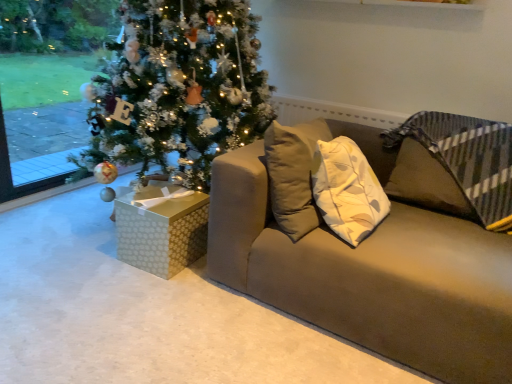
Question: From the image's perspective, is matte brown couch at center on top of gold-patterned gift box at lower left?

Choices:
 (A) yes
 (B) no

Answer: (A)

Question: Does matte brown couch at center come in front of gold-patterned gift box at lower left?

Choices:
 (A) yes
 (B) no

Answer: (A)

Question: From the image's perspective, would you say matte brown couch at center is shown under gold-patterned gift box at lower left?

Choices:
 (A) no
 (B) yes

Answer: (A)

Question: Is matte brown couch at center bigger than gold-patterned gift box at lower left?

Choices:
 (A) yes
 (B) no

Answer: (A)

Question: Is matte brown couch at center shorter than gold-patterned gift box at lower left?

Choices:
 (A) yes
 (B) no

Answer: (B)

Question: From a real-world perspective, is matte brown couch at center physically below gold-patterned gift box at lower left?

Choices:
 (A) no
 (B) yes

Answer: (A)

Question: Are gold-patterned gift box at lower left and matte brown couch at center making contact?

Choices:
 (A) yes
 (B) no

Answer: (B)

Question: Is matte brown couch at center completely or partially inside gold-patterned gift box at lower left?

Choices:
 (A) no
 (B) yes

Answer: (A)

Question: Considering the relative sizes of gold-patterned gift box at lower left and matte brown couch at center in the image provided, is gold-patterned gift box at lower left wider than matte brown couch at center?

Choices:
 (A) no
 (B) yes

Answer: (A)

Question: Considering the relative sizes of gold-patterned gift box at lower left and matte brown couch at center in the image provided, is gold-patterned gift box at lower left bigger than matte brown couch at center?

Choices:
 (A) yes
 (B) no

Answer: (B)

Question: Is gold-patterned gift box at lower left to the left of matte brown couch at center from the viewer's perspective?

Choices:
 (A) no
 (B) yes

Answer: (B)

Question: Considering the relative positions of gold-patterned gift box at lower left and matte brown couch at center in the image provided, is gold-patterned gift box at lower left to the right of matte brown couch at center from the viewer's perspective?

Choices:
 (A) yes
 (B) no

Answer: (B)

Question: From the image's perspective, is matte brown couch at center located above or below gold-patterned gift box at lower left?

Choices:
 (A) above
 (B) below

Answer: (A)